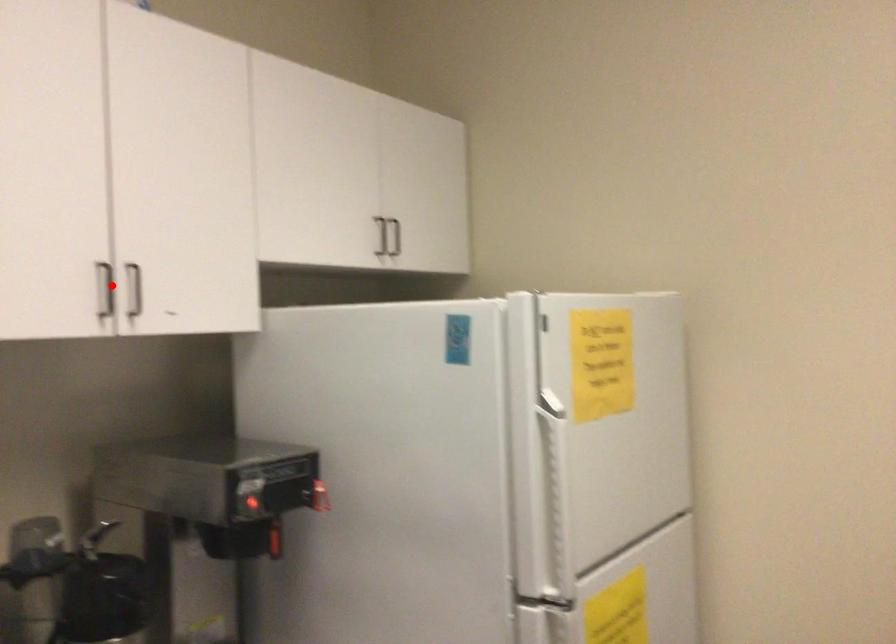
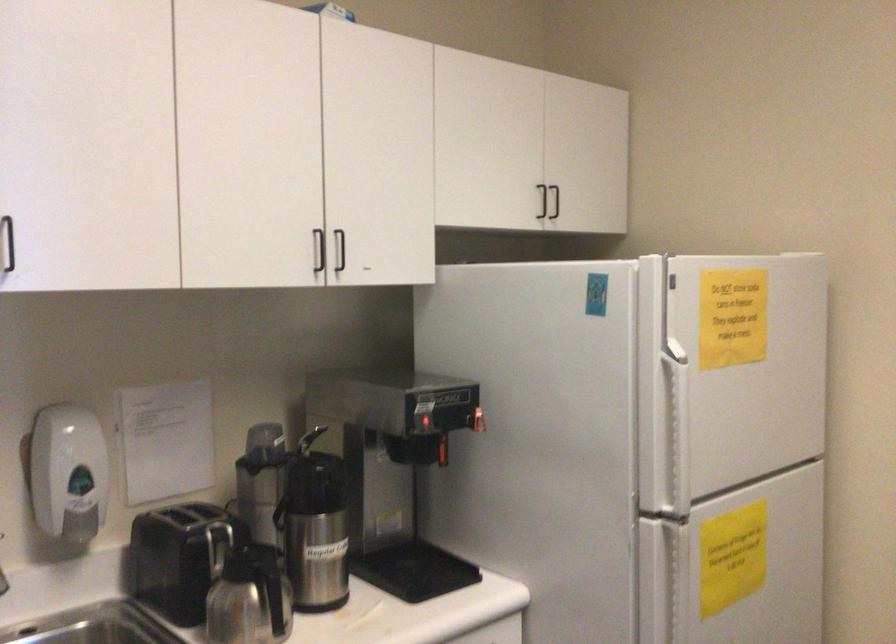
Locate, in the second image, the point that corresponds to the highlighted location in the first image.

(319, 250)